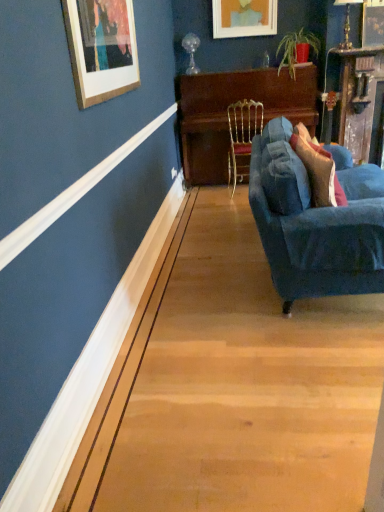
Question: From a real-world perspective, is wooden picture frame at upper right, the second picture frame in the left-to-right sequence, beneath wooden piano at center?

Choices:
 (A) no
 (B) yes

Answer: (A)

Question: Is wooden piano at center a part of wooden picture frame at upper right, the second picture frame in the left-to-right sequence?

Choices:
 (A) no
 (B) yes

Answer: (A)

Question: Is wooden picture frame at upper right, the second picture frame in the left-to-right sequence, not close to wooden piano at center?

Choices:
 (A) yes
 (B) no

Answer: (A)

Question: Considering the relative sizes of wooden picture frame at upper right, marked as the first picture frame in a front-to-back arrangement, and wooden piano at center in the image provided, is wooden picture frame at upper right, marked as the first picture frame in a front-to-back arrangement, thinner than wooden piano at center?

Choices:
 (A) no
 (B) yes

Answer: (B)

Question: From a real-world perspective, is wooden picture frame at upper right, which ranks as the 1th picture frame in bottom-to-top order, on wooden piano at center?

Choices:
 (A) yes
 (B) no

Answer: (A)

Question: Is wooden picture frame at upper right, marked as the first picture frame in a front-to-back arrangement, oriented away from wooden piano at center?

Choices:
 (A) yes
 (B) no

Answer: (B)

Question: From a real-world perspective, is matte wooden picture frame at upper center, positioned as the 1th picture frame in left-to-right order, on wooden picture frame at upper right, marked as the first picture frame in a front-to-back arrangement?

Choices:
 (A) yes
 (B) no

Answer: (A)

Question: Is matte wooden picture frame at upper center, positioned as the 1th picture frame in left-to-right order, looking in the opposite direction of wooden picture frame at upper right, the second picture frame in the left-to-right sequence?

Choices:
 (A) yes
 (B) no

Answer: (B)

Question: Would you consider matte wooden picture frame at upper center, which is the 2th picture frame in front-to-back order, to be distant from wooden picture frame at upper right, the second picture frame in the left-to-right sequence?

Choices:
 (A) yes
 (B) no

Answer: (A)

Question: Can you confirm if matte wooden picture frame at upper center, which is counted as the first picture frame, starting from the top, is thinner than wooden picture frame at upper right, marked as the 2th picture frame in a back-to-front arrangement?

Choices:
 (A) yes
 (B) no

Answer: (B)

Question: Is matte wooden picture frame at upper center, the 1th picture frame from the back, completely or partially outside of wooden picture frame at upper right, which ranks as the 1th picture frame in bottom-to-top order?

Choices:
 (A) yes
 (B) no

Answer: (A)

Question: Can you confirm if matte wooden picture frame at upper center, placed as the 2th picture frame when sorted from right to left, is taller than wooden picture frame at upper right, positioned as the second picture frame in top-to-bottom order?

Choices:
 (A) yes
 (B) no

Answer: (B)

Question: From a real-world perspective, is velvet blue pillow at right over wooden piano at center?

Choices:
 (A) no
 (B) yes

Answer: (B)